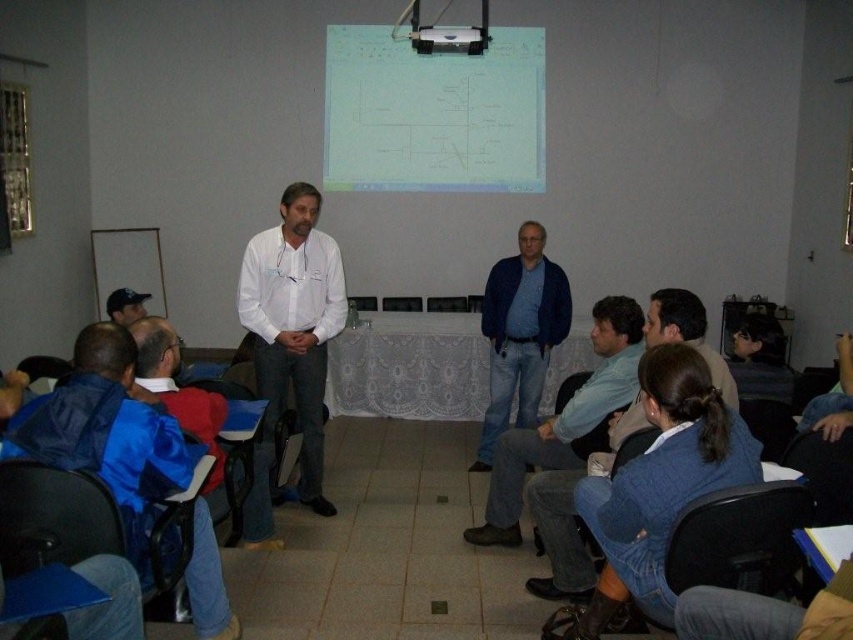
You are an attendee in the classroom and want to know if the white paper at upper center is larger than the blue jeans at center. Can you confirm this?

The white paper at upper center is bigger than the blue jeans at center, so yes, the white paper at upper center is larger than the blue jeans at center.

You are a photographer standing at the back of the room. You want to take a photo of the white plastic projector at upper center and the blue jeans at center. Which object will appear larger in the photo?

The blue jeans at center will appear larger in the photo because it is taller than the white plastic projector at upper center.